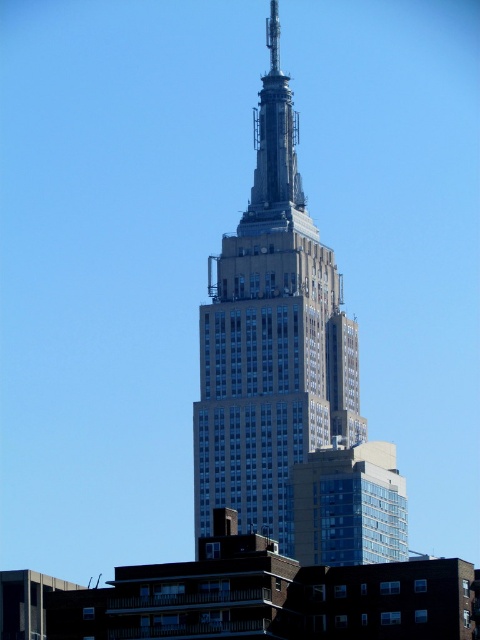
You are standing in front of the Empire State Building and want to take a photo that includes both the point at coordinates point (262, 504) and the point at coordinates point (260, 156). Which point should you focus on first to ensure both are in the frame?

You should focus on point (262, 504) first because it is closer to you than point (260, 156), ensuring both points are within the camera frame.

You are standing at the base of the Empire State Building and want to take a photo of the point at coordinates point (315, 417) on the building. If your camera has a maximum focus range of 300 meters, will it be able to focus on that point?

The distance of point (315, 417) from the camera is 294.65 meters, which is within the camera maximum focus range of 300 meters. Therefore, the camera can focus on the point (315, 417).

You are a city planner assessing the skyline. You need to determine if the white stone building at center and the metallic silver spire at upper center can both be seen from a nearby park. Knowing that the park is located to the east of the buildings, which direction should you face to ensure both structures are visible?

Both the white stone building at center and the metallic silver spire at upper center are visible when facing west, as the park is located to the east of the buildings.